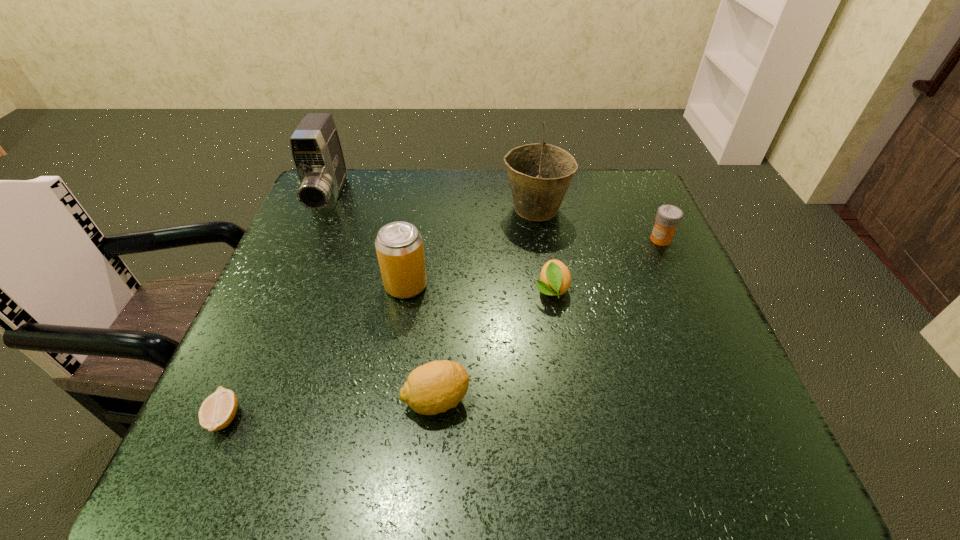
Where is `free location at the right edge`? The height and width of the screenshot is (540, 960). free location at the right edge is located at coordinates (742, 387).

In the image, there is a desktop. Identify the location of blank space at the far left corner. (348, 213).

At what (x,y) coordinates should I click in order to perform the action: click on vacant area at the near left corner of the desktop. Please return your answer as a coordinate pair (x, y). Image resolution: width=960 pixels, height=540 pixels. Looking at the image, I should click on (244, 453).

Image resolution: width=960 pixels, height=540 pixels. In the image, there is a desktop. Identify the location of vacant area at the far right corner. (627, 173).

Where is `vacant area that lies between the fifth shortest object and the second lemon from left to right`? vacant area that lies between the fifth shortest object and the second lemon from left to right is located at coordinates (421, 342).

I want to click on vacant point located between the leftmost lemon and the second lemon from left to right, so click(330, 408).

You are a GUI agent. You are given a task and a screenshot of the screen. Output one action in this format:
    pyautogui.click(x=<x>, y=<y>)
    Task: Click on the free point between the second tallest lemon and the second lemon from right to left
    This screenshot has height=540, width=960.
    Given the screenshot: What is the action you would take?
    pyautogui.click(x=493, y=345)

At what (x,y) coordinates should I click in order to perform the action: click on vacant space in between the second tallest object and the pop (soda). Please return your answer as a coordinate pair (x, y). The width and height of the screenshot is (960, 540). Looking at the image, I should click on (368, 242).

What are the coordinates of `free space between the tallest object and the second shortest object` in the screenshot? It's located at (543, 249).

Identify the location of free space between the medicine and the leftmost lemon. (443, 328).